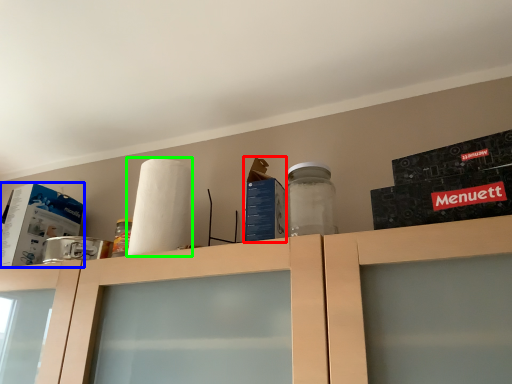
Question: Which is nearer to the box (highlighted by a red box)? box (highlighted by a blue box) or paper towel (highlighted by a green box).

Choices:
 (A) box
 (B) paper towel

Answer: (B)